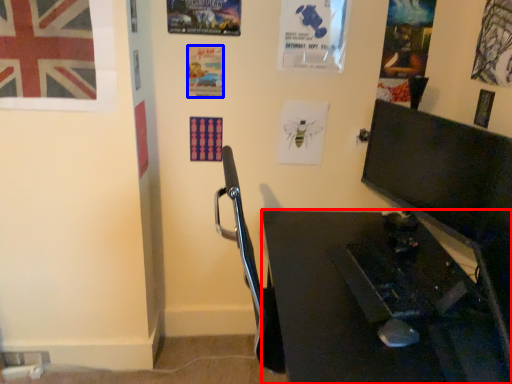
Question: Which object appears closest to the camera in this image, desk (highlighted by a red box) or poster page (highlighted by a blue box)?

Choices:
 (A) desk
 (B) poster page

Answer: (A)